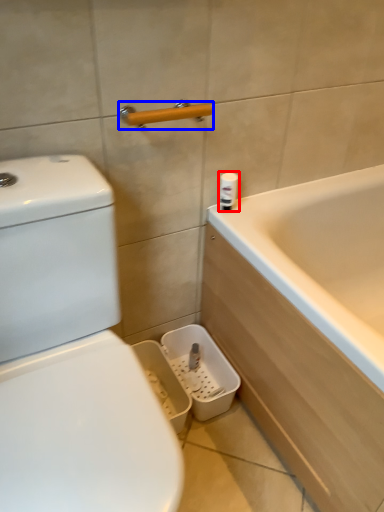
Question: Which point is further to the camera, toiletry (highlighted by a red box) or towel bar (highlighted by a blue box)?

Choices:
 (A) toiletry
 (B) towel bar

Answer: (A)